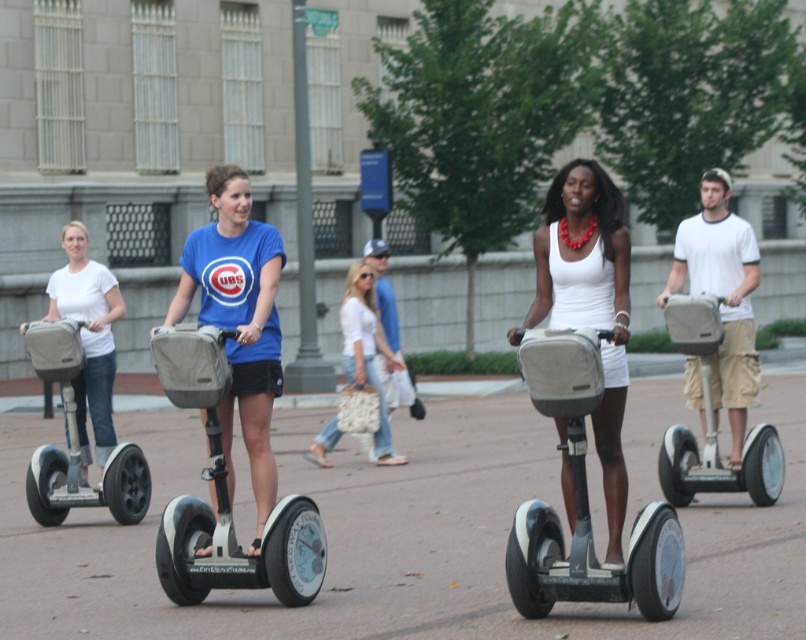
Question: Is smooth concrete pavement at center below matte gray scooter at center?

Choices:
 (A) no
 (B) yes

Answer: (A)

Question: Which point is closer to the camera?

Choices:
 (A) white matte segway at center
 (B) white matte tank top at center
 (C) white matte shirt at left
 (D) smooth concrete pavement at center

Answer: (B)

Question: Which of the following is the closest to the observer?

Choices:
 (A) smooth concrete pavement at center
 (B) white cotton shirt at center

Answer: (A)

Question: Which of these objects is positioned farthest from the tan fabric scooter at right?

Choices:
 (A) white matte shirt at left
 (B) white matte tank top at center
 (C) matte blue shirt at center

Answer: (A)

Question: Does matte gray scooter at center lie in front of white matte segway at center?

Choices:
 (A) no
 (B) yes

Answer: (B)

Question: Is matte blue shirt at center positioned behind tan fabric scooter at right?

Choices:
 (A) no
 (B) yes

Answer: (A)